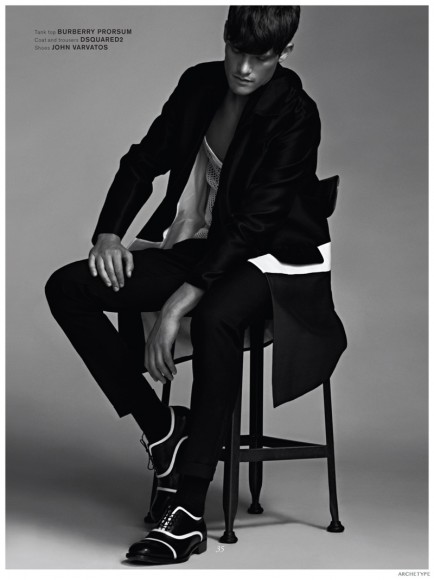
You are a GUI agent. You are given a task and a screenshot of the screen. Output one action in this format:
    pyautogui.click(x=<x>, y=<y>)
    Task: Click on the stool
    The height and width of the screenshot is (580, 434).
    Given the screenshot: What is the action you would take?
    pyautogui.click(x=228, y=505)